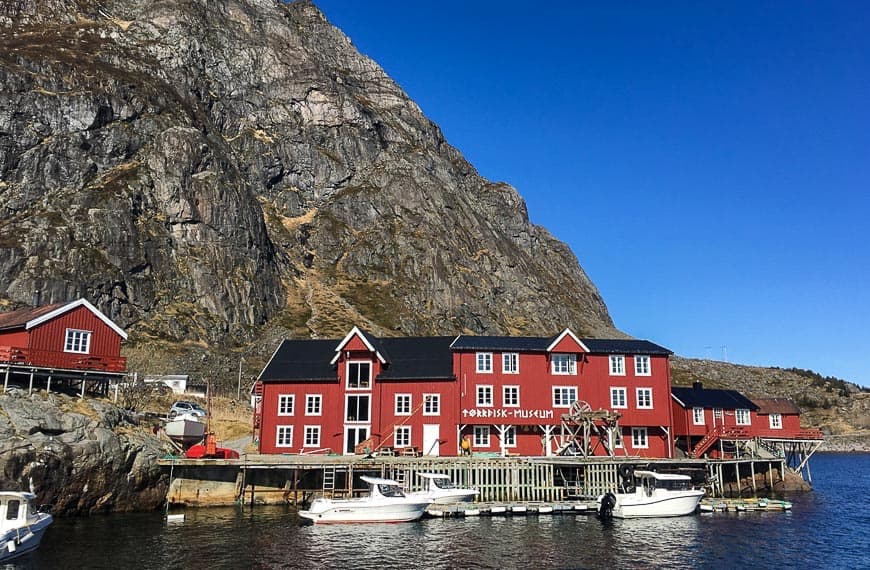
Where is `double doors`? The image size is (870, 570). double doors is located at coordinates (357, 374), (358, 401), (358, 442).